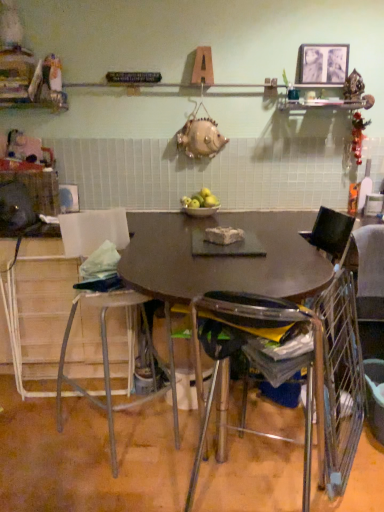
The height and width of the screenshot is (512, 384). In order to click on blank space situated above matte brown table at center (from a real-world perspective) in this screenshot , I will do `click(222, 258)`.